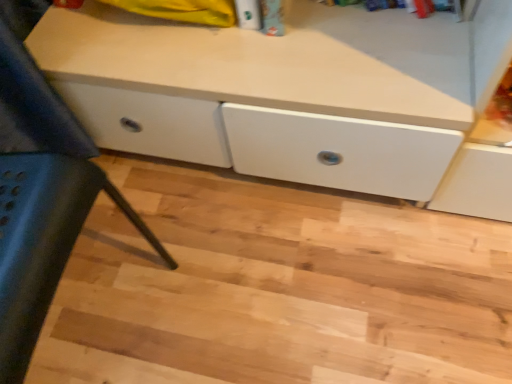
Image resolution: width=512 pixels, height=384 pixels. Identify the location of free space to the right of matte white cabinet at lower left. (228, 273).